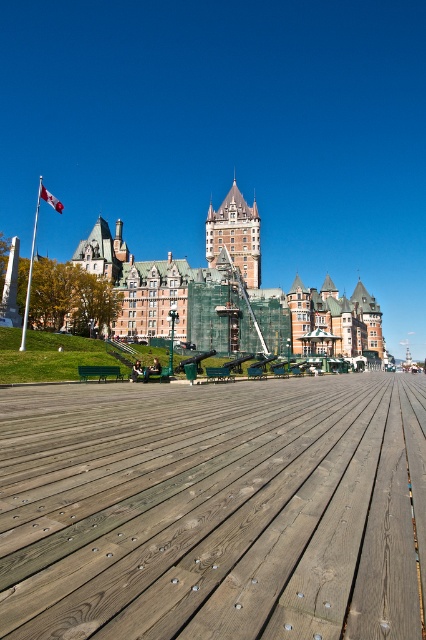
Question: From the image, what is the correct spatial relationship of wooden at center in relation to white fabric flag at upper left?

Choices:
 (A) right
 (B) left

Answer: (A)

Question: Can you confirm if wooden at center is positioned above orange brick building at center?

Choices:
 (A) no
 (B) yes

Answer: (A)

Question: Estimate the real-world distances between objects in this image. Which object is farther from the orange brick building at center?

Choices:
 (A) white fabric flag at upper left
 (B) wooden at center

Answer: (A)

Question: Estimate the real-world distances between objects in this image. Which object is closer to the wooden at center?

Choices:
 (A) orange brick building at center
 (B) white fabric flag at upper left

Answer: (A)

Question: Is the position of wooden at center more distant than that of orange brick building at center?

Choices:
 (A) yes
 (B) no

Answer: (B)

Question: Based on their relative distances, which object is nearer to the orange brick building at center?

Choices:
 (A) white fabric flag at upper left
 (B) wooden at center

Answer: (B)